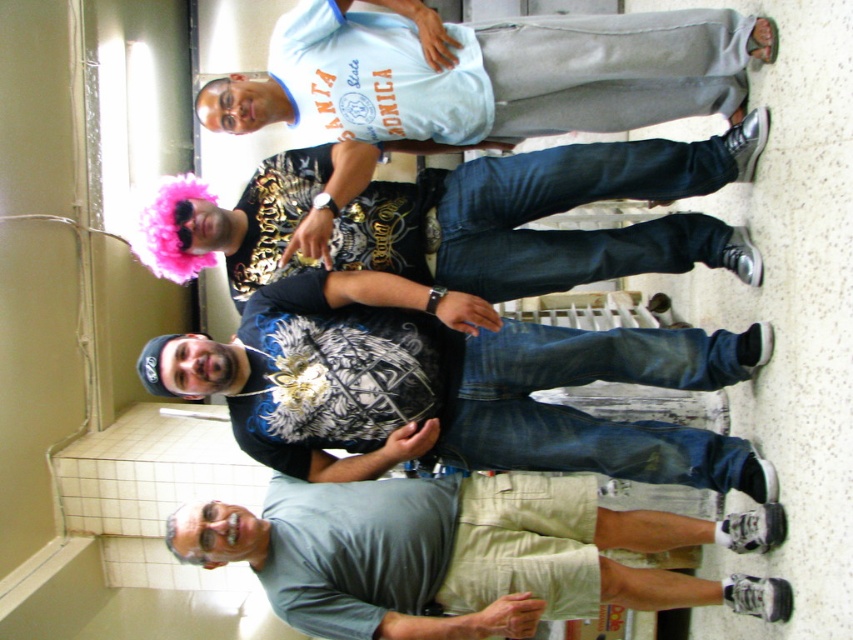
Measure the distance between black matte t-shirt at center and camera.

They are 6.52 feet apart.

Can you confirm if black matte t-shirt at center is wider than light blue cotton shirt at center?

Indeed, black matte t-shirt at center has a greater width compared to light blue cotton shirt at center.

Locate an element on the screen. black matte t-shirt at center is located at coordinates (451, 387).

How far apart are black matte t-shirt at center and gray cotton t-shirt at lower center?

They are 11.33 inches apart.

Is point (238, 381) behind point (670, 540)?

Yes, point (238, 381) is behind point (670, 540).

Is point (587, 464) positioned before point (218, 536)?

No, (587, 464) is behind (218, 536).

This screenshot has width=853, height=640. I want to click on black matte t-shirt at center, so click(x=451, y=387).

Does black matte t-shirt at center have a lesser height compared to pink fluffy wig at upper left?

No, black matte t-shirt at center is not shorter than pink fluffy wig at upper left.

What do you see at coordinates (451, 387) in the screenshot? I see `black matte t-shirt at center` at bounding box center [451, 387].

This screenshot has width=853, height=640. I want to click on black matte t-shirt at center, so click(451, 387).